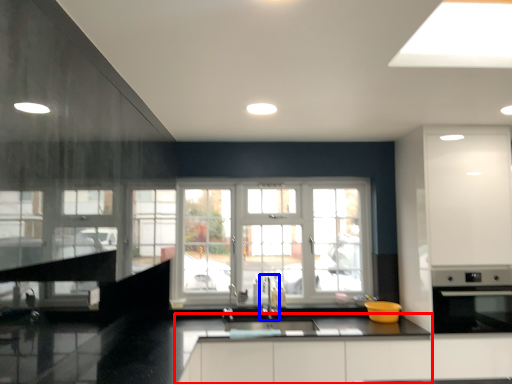
Question: Which object appears farthest to the camera in this image, counter top (highlighted by a red box) or faucet (highlighted by a blue box)?

Choices:
 (A) counter top
 (B) faucet

Answer: (B)